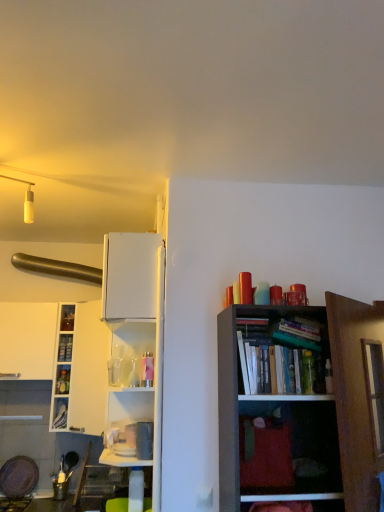
Question: Is white glossy cabinet at left, the 1th cabinet when ordered from top to bottom, facing towards metallic blue cabinet at left, which is the 2th cabinet from top to bottom?

Choices:
 (A) no
 (B) yes

Answer: (A)

Question: Is metallic blue cabinet at left, placed as the 1th cabinet when sorted from bottom to top, at the back of white glossy cabinet at left, which is counted as the second cabinet, starting from the bottom?

Choices:
 (A) no
 (B) yes

Answer: (A)

Question: Does white glossy cabinet at left, the 1th cabinet when ordered from top to bottom, have a smaller size compared to metallic blue cabinet at left, which is the 2th cabinet from top to bottom?

Choices:
 (A) no
 (B) yes

Answer: (B)

Question: Are white glossy cabinet at left, which is counted as the second cabinet, starting from the bottom, and metallic blue cabinet at left, placed as the 1th cabinet when sorted from bottom to top, located far from each other?

Choices:
 (A) yes
 (B) no

Answer: (B)

Question: From a real-world perspective, is white glossy cabinet at left, the 1th cabinet when ordered from top to bottom, located beneath metallic blue cabinet at left, which is the 2th cabinet from top to bottom?

Choices:
 (A) yes
 (B) no

Answer: (B)

Question: Is white glossy cabinet at left, the 1th cabinet when ordered from top to bottom, taller than metallic blue cabinet at left, which is the 2th cabinet from top to bottom?

Choices:
 (A) no
 (B) yes

Answer: (A)

Question: Is metallic blue cabinet at left, which is the 2th cabinet from top to bottom, taller than hardcover book at upper right, the 1th book in the top-to-bottom sequence?

Choices:
 (A) yes
 (B) no

Answer: (A)

Question: Can we say metallic blue cabinet at left, which is the 2th cabinet from top to bottom, lies outside hardcover book at upper right, which ranks as the first book in front-to-back order?

Choices:
 (A) yes
 (B) no

Answer: (A)

Question: Is metallic blue cabinet at left, placed as the 1th cabinet when sorted from bottom to top, at the left side of hardcover book at upper right, which is the second book in back-to-front order?

Choices:
 (A) yes
 (B) no

Answer: (A)

Question: Is metallic blue cabinet at left, placed as the 1th cabinet when sorted from bottom to top, bigger than hardcover book at upper right, which is counted as the 1th book, starting from the right?

Choices:
 (A) yes
 (B) no

Answer: (B)

Question: From a real-world perspective, is metallic blue cabinet at left, placed as the 1th cabinet when sorted from bottom to top, over hardcover book at upper right, marked as the 2th book in a bottom-to-top arrangement?

Choices:
 (A) yes
 (B) no

Answer: (B)

Question: Is hardcover book at upper right, the 1th book in the top-to-bottom sequence, at the back of metallic blue cabinet at left, which is the 2th cabinet from top to bottom?

Choices:
 (A) no
 (B) yes

Answer: (A)

Question: Is hardcover book at upper right, which ranks as the first book in front-to-back order, taller than white glossy cabinet at left?

Choices:
 (A) no
 (B) yes

Answer: (A)